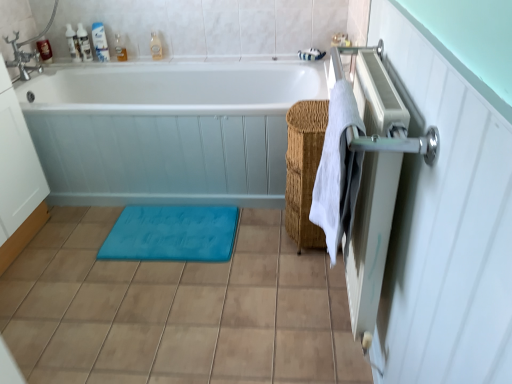
You are a GUI agent. You are given a task and a screenshot of the screen. Output one action in this format:
    pyautogui.click(x=<x>, y=<y>)
    Task: Click on the free space to the left of woven brown basket at center-right
    The image size is (512, 384).
    Given the screenshot: What is the action you would take?
    pyautogui.click(x=262, y=221)